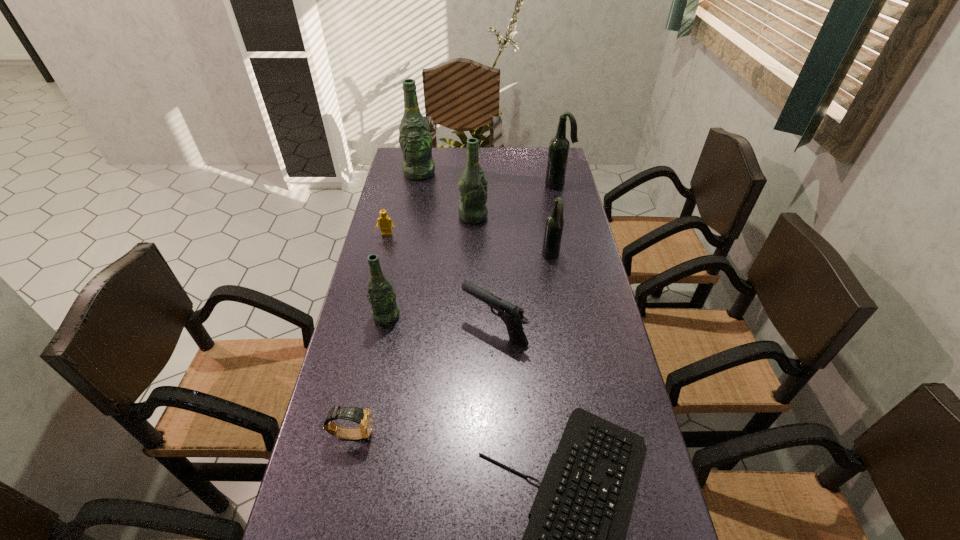
At what (x,y) coordinates should I click in order to perform the action: click on free space located at the muzzle of the gun. Please return your answer as a coordinate pair (x, y). Looking at the image, I should click on (444, 329).

Locate an element on the screen. vacant region located on the face of the fourth farthest object is located at coordinates (375, 280).

The width and height of the screenshot is (960, 540). Find the location of `vacant space situated 0.220m on the face of the watch`. vacant space situated 0.220m on the face of the watch is located at coordinates (469, 434).

This screenshot has height=540, width=960. What are the coordinates of `object located at the far edge` in the screenshot? It's located at (415, 139).

The image size is (960, 540). I want to click on Lego at the left edge, so click(386, 225).

In order to click on watch that is at the left edge in this screenshot , I will do `click(363, 417)`.

The image size is (960, 540). I want to click on object situated at the far left corner, so click(x=415, y=139).

This screenshot has width=960, height=540. I want to click on free space at the left edge, so click(345, 513).

Identify the location of vacant position at the right edge of the desktop. This screenshot has height=540, width=960. (623, 404).

This screenshot has width=960, height=540. In the image, there is a desktop. In order to click on vacant space at the far right corner in this screenshot , I will do `click(532, 167)`.